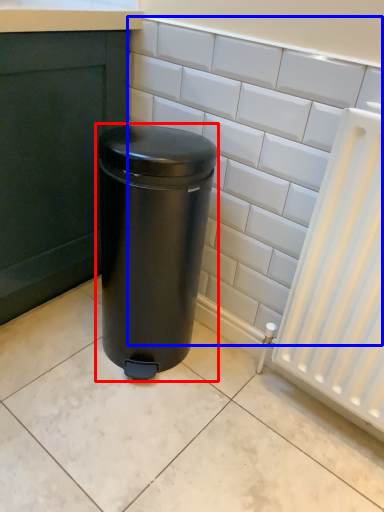
Question: Which point is closer to the camera, waste container (highlighted by a red box) or ceramic tile (highlighted by a blue box)?

Choices:
 (A) waste container
 (B) ceramic tile

Answer: (B)